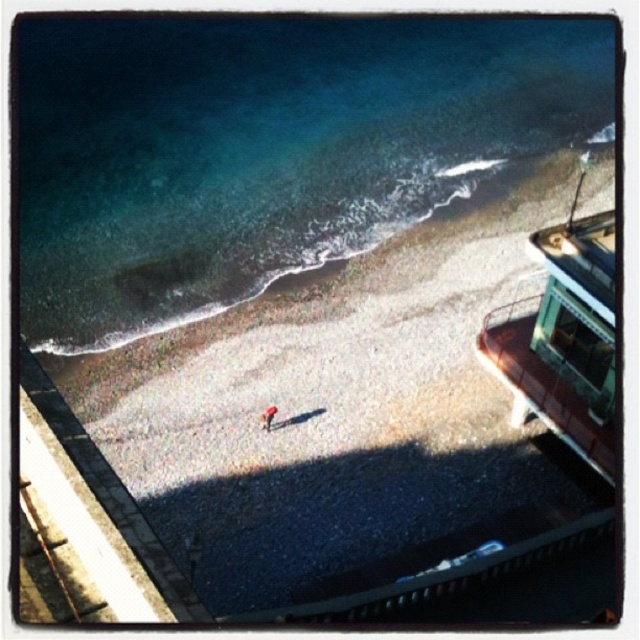
Question: Where is clear blue water at upper left located in relation to light brown fabric jacket at center in the image?

Choices:
 (A) above
 (B) below

Answer: (A)

Question: Does gray gravelly sand at center appear under metallic green boat at right?

Choices:
 (A) no
 (B) yes

Answer: (B)

Question: Can you confirm if clear blue water at upper left is bigger than metallic green boat at right?

Choices:
 (A) no
 (B) yes

Answer: (B)

Question: Which object is the closest to the light brown fabric jacket at center?

Choices:
 (A) metallic green boat at right
 (B) gray gravelly sand at center

Answer: (B)

Question: Based on their relative distances, which object is farther from the metallic green boat at right?

Choices:
 (A) clear blue water at upper left
 (B) gray gravelly sand at center
 (C) light brown fabric jacket at center

Answer: (A)

Question: Which of these objects is positioned closest to the gray gravelly sand at center?

Choices:
 (A) clear blue water at upper left
 (B) light brown fabric jacket at center

Answer: (A)